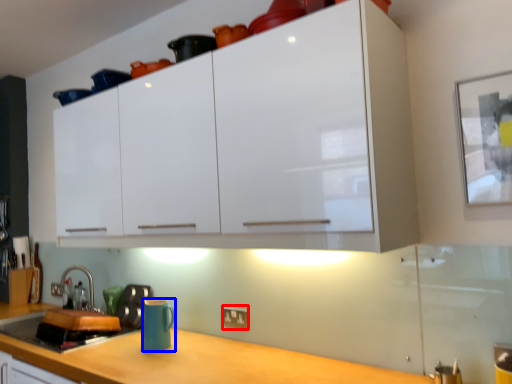
Question: Which of the following is the closest to the observer, electric outlet (highlighted by a red box) or mug (highlighted by a blue box)?

Choices:
 (A) electric outlet
 (B) mug

Answer: (B)